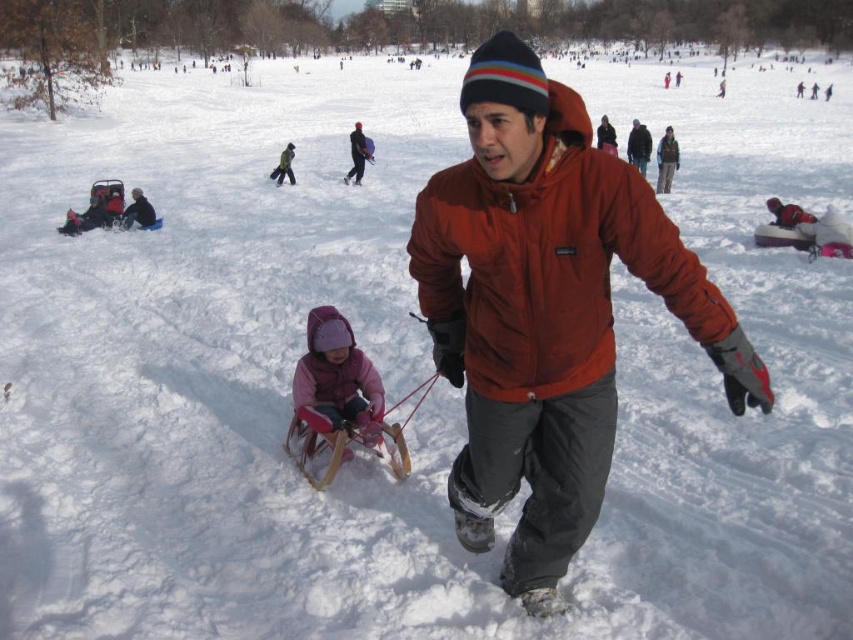
Which is more to the right, pink fleece jacket at center or brushed metal snowsuit at center?

pink fleece jacket at center

Is pink fleece jacket at center taller than brushed metal snowsuit at center?

Yes, pink fleece jacket at center is taller than brushed metal snowsuit at center.

Between point (300, 397) and point (288, 177), which one is positioned in front?

Positioned in front is point (300, 397).

Locate an element on the screen. pink fleece jacket at center is located at coordinates (335, 380).

Which of these two, dark brown leather jacket at upper center or dark gray woolen hat at upper center, stands shorter?

dark brown leather jacket at upper center

Can you confirm if dark brown leather jacket at upper center is positioned above dark gray woolen hat at upper center?

Actually, dark brown leather jacket at upper center is below dark gray woolen hat at upper center.

In the scene shown: Who is more forward, (636,156) or (599,147)?

Point (636,156) is more forward.

The width and height of the screenshot is (853, 640). Identify the location of dark brown leather jacket at upper center. pyautogui.click(x=637, y=147).

Can you confirm if orange fleece jacket at center is thinner than pink fleece jacket at center?

No.

Describe the element at coordinates (547, 264) in the screenshot. I see `orange fleece jacket at center` at that location.

The image size is (853, 640). What do you see at coordinates (547, 264) in the screenshot?
I see `orange fleece jacket at center` at bounding box center [547, 264].

Where is `orange fleece jacket at center`? orange fleece jacket at center is located at coordinates (547, 264).